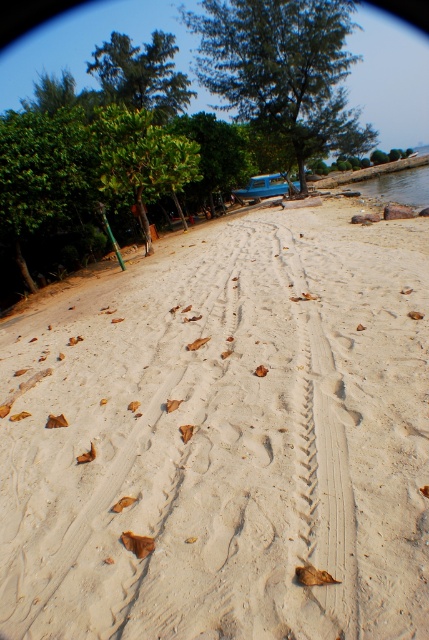
Is green leafy tree at left closer to the viewer compared to green leafy tree at center?

Yes, it is.

Does point (141, 122) come farther from viewer compared to point (244, 163)?

No, it is not.

Locate an element on the screen. Image resolution: width=429 pixels, height=640 pixels. green leafy tree at left is located at coordinates (141, 157).

Does point (224, 97) come closer to viewer compared to point (141, 49)?

Yes, it is.

Between green leafy tree at upper center and green leafy tree at upper left, which one is positioned higher?

green leafy tree at upper left is above.

Who is more distant from viewer, (320, 104) or (115, 83)?

Point (115, 83)

This screenshot has height=640, width=429. I want to click on green leafy tree at upper center, so click(x=283, y=70).

Who is higher up, green leafy tree at upper center or green leafy tree at center?

green leafy tree at upper center

Is green leafy tree at upper center thinner than green leafy tree at center?

No, green leafy tree at upper center is not thinner than green leafy tree at center.

This screenshot has height=640, width=429. In order to click on green leafy tree at upper center in this screenshot , I will do `click(283, 70)`.

Locate an element on the screen. green leafy tree at upper center is located at coordinates (283, 70).